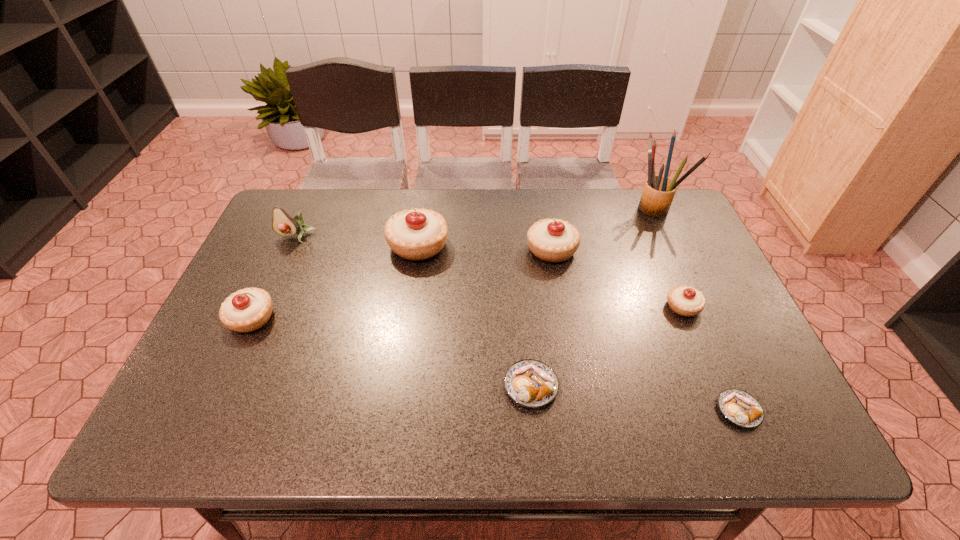
Identify the location of vacant space located 0.290m on the back of the third shortest pastry. This screenshot has height=540, width=960. (648, 224).

You are a GUI agent. You are given a task and a screenshot of the screen. Output one action in this format:
    pyautogui.click(x=<x>, y=<y>)
    Task: Click on the vacant area situated 0.220m on the back of the left brown pastry
    The width and height of the screenshot is (960, 540).
    Given the screenshot: What is the action you would take?
    [522, 292]

In order to click on vacant space located 0.270m on the back of the smaller brown pastry in this screenshot , I will do `click(689, 298)`.

Find the location of a particular element. pencil box that is positioned at the far edge is located at coordinates (658, 193).

Find the location of a particular element. avocado that is positioned at the far edge is located at coordinates (283, 224).

Where is `avocado that is at the left edge`? The image size is (960, 540). avocado that is at the left edge is located at coordinates (283, 224).

Identify the location of pastry situated at the left edge. (249, 309).

Identify the location of pencil box situated at the right edge. (658, 193).

Identify the location of object present at the far left corner. Image resolution: width=960 pixels, height=540 pixels. (283, 224).

Locate an element on the screen. This screenshot has height=540, width=960. object located in the far right corner section of the desktop is located at coordinates (658, 193).